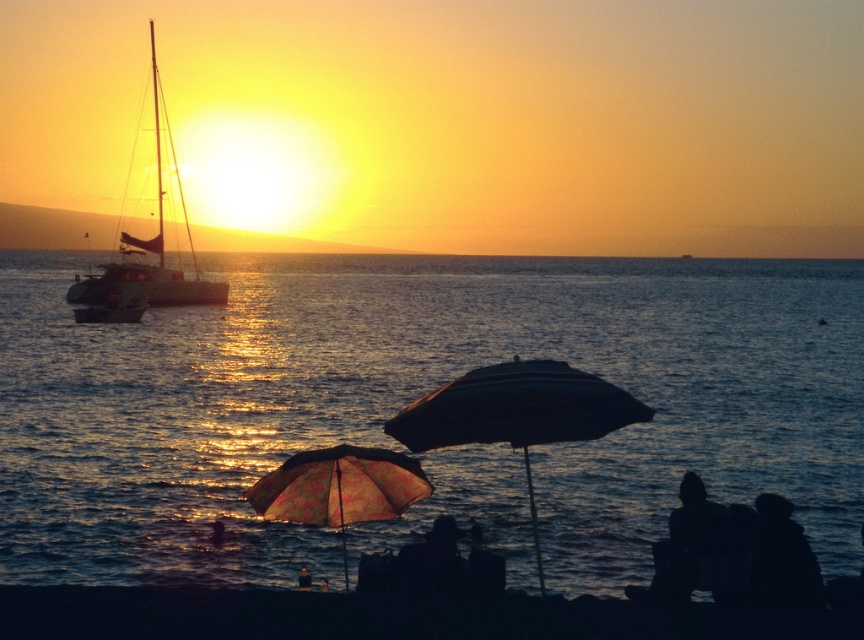
Question: Considering the real-world distances, which object is farthest from the printed fabric umbrella at lower center?

Choices:
 (A) dark striped umbrella at center
 (B) white matte sailboat at left
 (C) black sand at lower center
 (D) blue water at center

Answer: (D)

Question: Does printed fabric umbrella at lower center appear over white matte sailboat at left?

Choices:
 (A) no
 (B) yes

Answer: (A)

Question: Does black sand at lower center have a lesser width compared to dark striped umbrella at center?

Choices:
 (A) no
 (B) yes

Answer: (A)

Question: Which of the following is the closest to the observer?

Choices:
 (A) printed fabric umbrella at lower center
 (B) dark striped umbrella at center
 (C) white matte sailboat at left

Answer: (B)

Question: Can you confirm if blue water at center is positioned above white matte sailboat at left?

Choices:
 (A) no
 (B) yes

Answer: (A)

Question: Which object is positioned closest to the printed fabric umbrella at lower center?

Choices:
 (A) white matte sailboat at left
 (B) black sand at lower center
 (C) dark striped umbrella at center
 (D) blue water at center

Answer: (B)